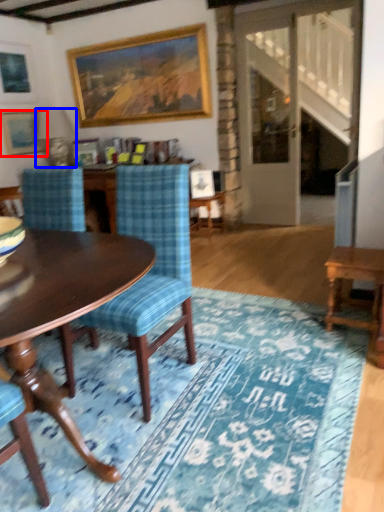
Question: Which point is further to the camera, picture frame (highlighted by a red box) or lamp (highlighted by a blue box)?

Choices:
 (A) picture frame
 (B) lamp

Answer: (A)